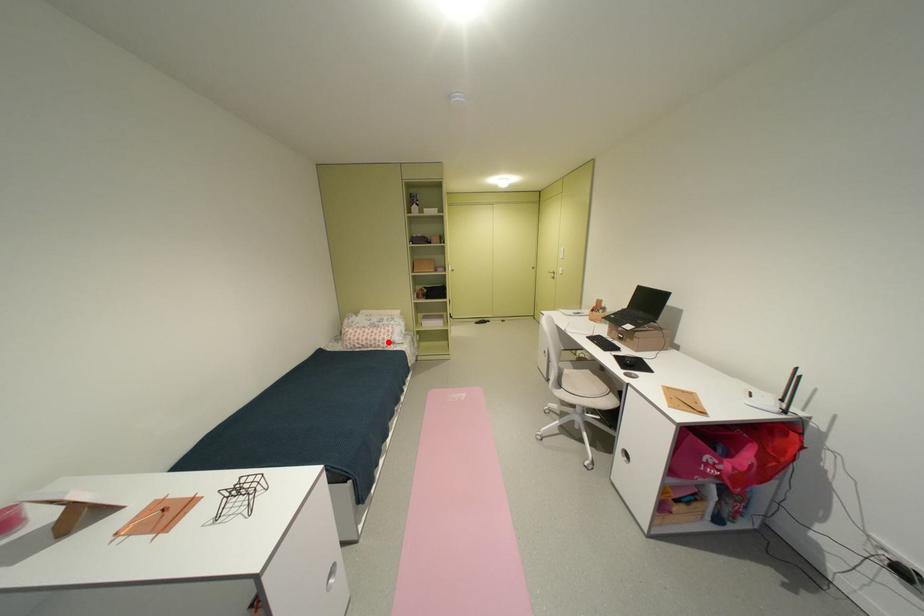
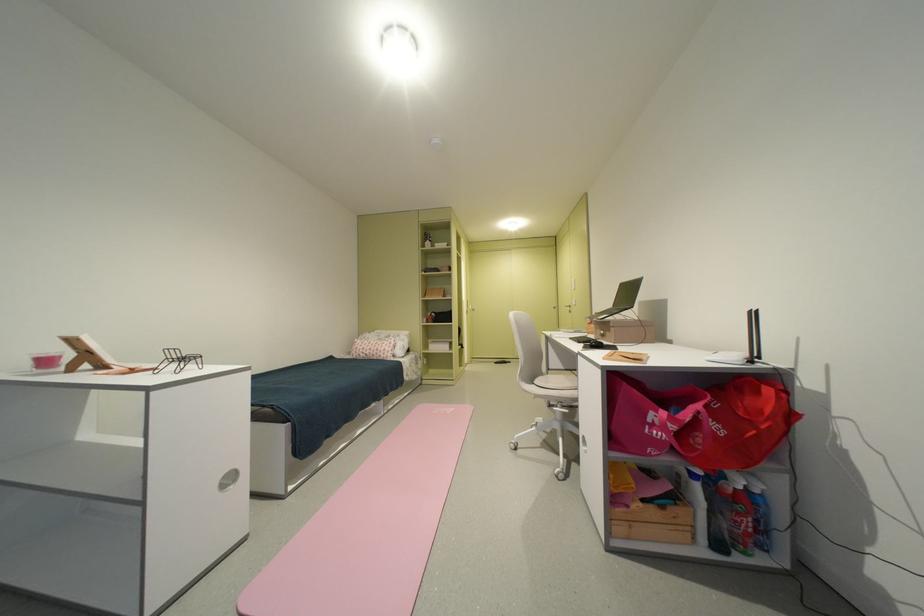
Where in the second image is the point corresponding to the highlighted location from the first image?

(390, 352)